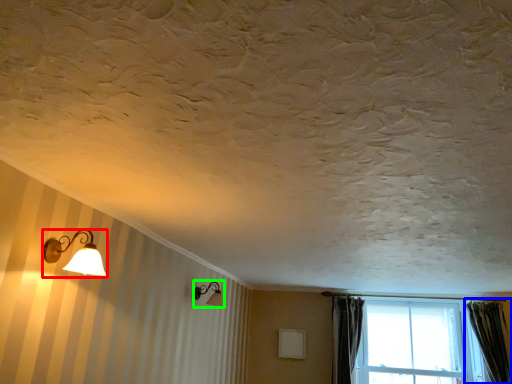
Question: Which object is the farthest from lamp (highlighted by a red box)? Choose among these: curtain (highlighted by a blue box) or lamp (highlighted by a green box).

Choices:
 (A) curtain
 (B) lamp

Answer: (A)